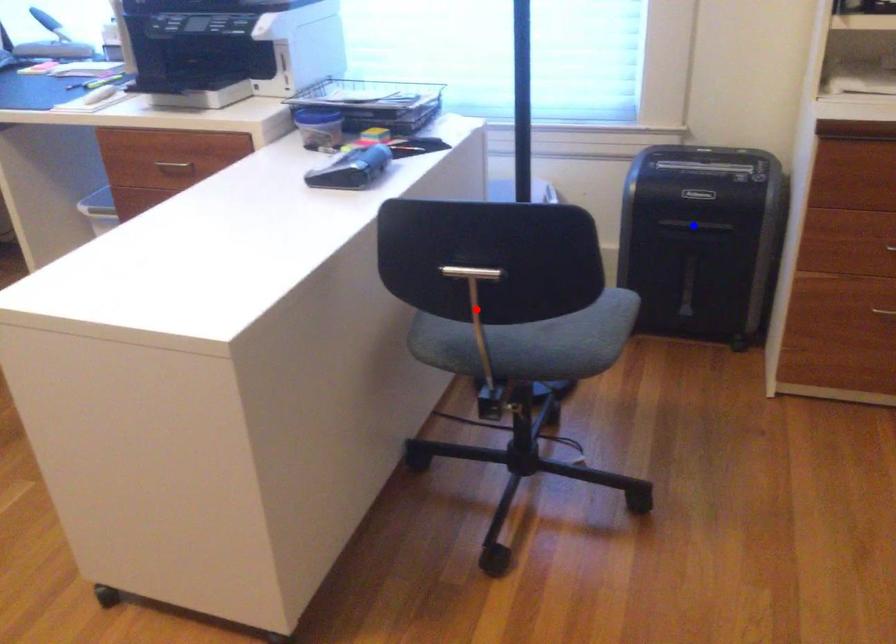
Question: Two points are marked on the image. Which point is closer to the camera?

Choices:
 (A) Blue point is closer.
 (B) Red point is closer.

Answer: (B)